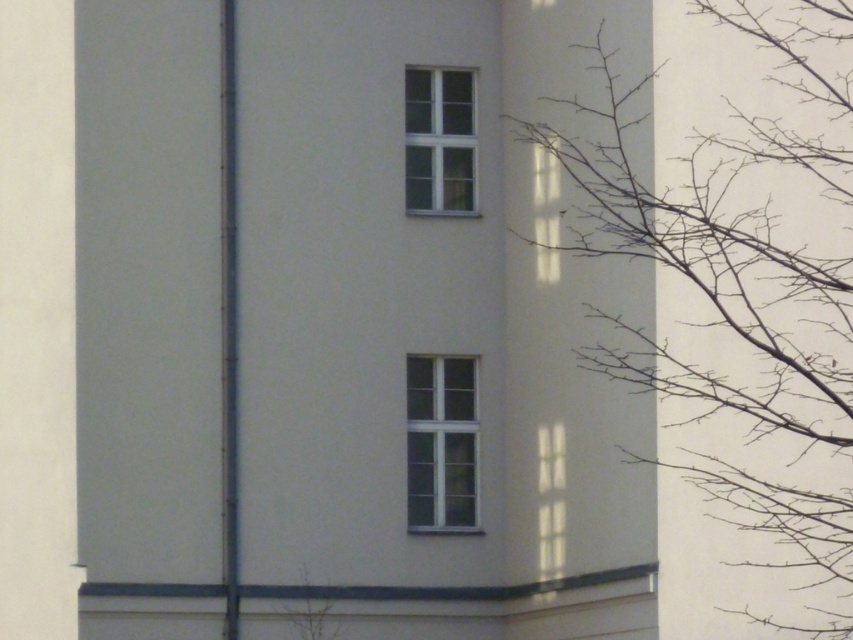
You are standing in front of the building and notice a point marked at coordinates (741,284). What object or feature does this point correspond to?

The point at coordinates (741,284) corresponds to the bare branches at right.

You are a window installer and need to replace both the clear glass window at center and the white plastic window at upper center. Which window requires a larger replacement pane?

The clear glass window at center requires a larger replacement pane since it is bigger than the white plastic window at upper center.

You are an architect designing a new building and want to ensure that the bare branches at right and the clear glass window at center are visible from the main entrance. Given their sizes, which object will appear bigger when viewed from the entrance?

The bare branches at right will appear bigger than the clear glass window at center because it is larger in size.